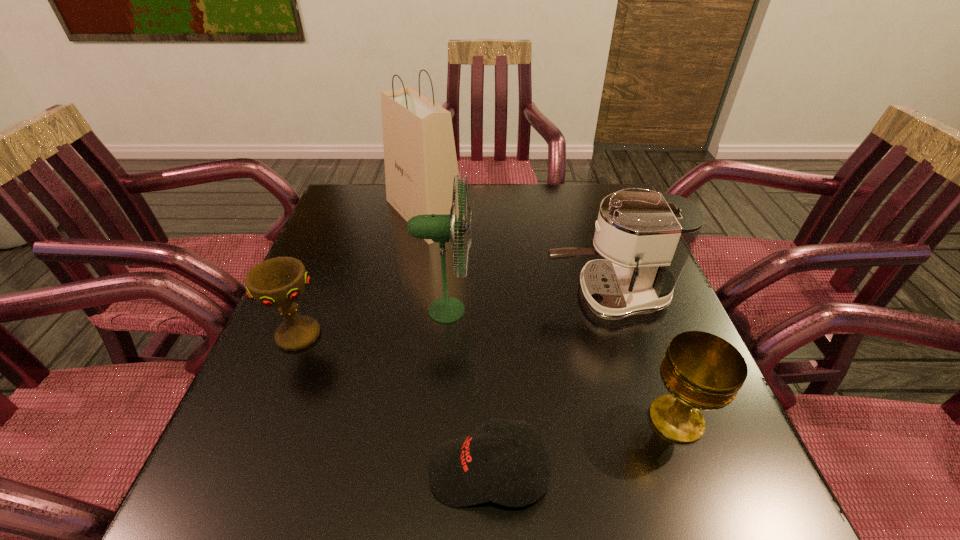
The image size is (960, 540). I want to click on vacant space at the near right corner, so click(667, 518).

The width and height of the screenshot is (960, 540). What are the coordinates of `free space between the nearer chalice and the baseball cap` in the screenshot? It's located at (583, 446).

Locate an element on the screen. The width and height of the screenshot is (960, 540). free spot between the fan and the farther chalice is located at coordinates (372, 323).

At what (x,y) coordinates should I click in order to perform the action: click on free space between the fourth shortest object and the shortest object. Please return your answer as a coordinate pair (x, y). This screenshot has height=540, width=960. Looking at the image, I should click on (548, 384).

Image resolution: width=960 pixels, height=540 pixels. Identify the location of vacant point located between the leftmost object and the fan. (372, 323).

At what (x,y) coordinates should I click in order to perform the action: click on empty location between the fan and the baseball cap. Please return your answer as a coordinate pair (x, y). Looking at the image, I should click on (468, 391).

At what (x,y) coordinates should I click in order to perform the action: click on blank region between the shortest object and the second tallest object. Please return your answer as a coordinate pair (x, y). The image size is (960, 540). Looking at the image, I should click on (468, 391).

Identify the location of empty space that is in between the fan and the fourth shortest object. This screenshot has width=960, height=540. 526,303.

Locate an element on the screen. empty location between the second tallest object and the shortest object is located at coordinates (468, 391).

You are a GUI agent. You are given a task and a screenshot of the screen. Output one action in this format:
    pyautogui.click(x=<x>, y=<y>)
    Task: Click on the empty space that is in between the shortest object and the nearer chalice
    The image size is (960, 540).
    Given the screenshot: What is the action you would take?
    pyautogui.click(x=583, y=446)